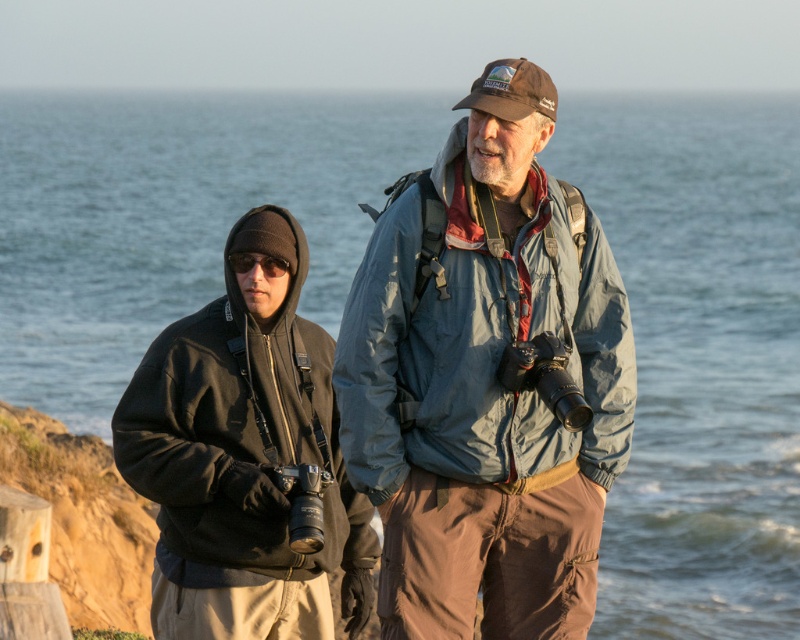
You are a photographer standing between the matte blue jacket at center and the dark gray fleece jacket at left. You need to place a tripod between them so that it is closer to the taller one. Which jacket should the tripod be placed near?

The matte blue jacket at center is taller than the dark gray fleece jacket at left, so the tripod should be placed closer to the matte blue jacket at center.

You are a photographer trying to decide which jacket to wear for a shoot. You need to choose between the matte blue jacket at center and the dark gray fleece jacket at left based on their sizes. Which jacket should you pick if you want the larger one?

The matte blue jacket at center is larger in size than the dark gray fleece jacket at left, so you should choose the matte blue jacket at center if you want the larger one.

You are a photographer trying to set up a tripod between the matte blue jacket at center and the dark gray fleece jacket at left. The tripod requires a minimum of 1.2 meters of space to be stable. Is there enough space between them?

The distance between the matte blue jacket at center and the dark gray fleece jacket at left is 1.35 meters, which is more than the required 1.2 meters. Therefore, there is sufficient space to set up the tripod stably between them.